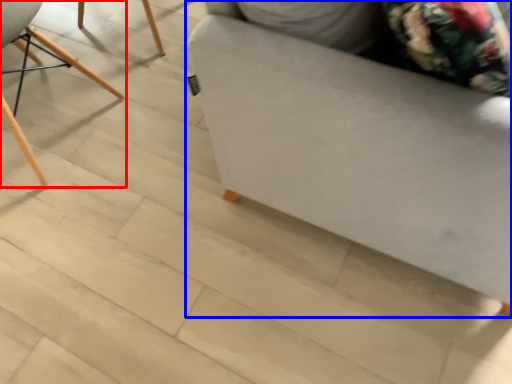
Question: Which of the following is the farthest to the observer, chair (highlighted by a red box) or furniture (highlighted by a blue box)?

Choices:
 (A) chair
 (B) furniture

Answer: (A)